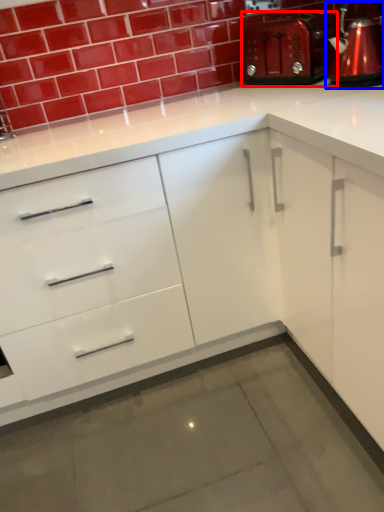
Question: Which object appears farthest to the camera in this image, appliance (highlighted by a red box) or coffeepot (highlighted by a blue box)?

Choices:
 (A) appliance
 (B) coffeepot

Answer: (A)